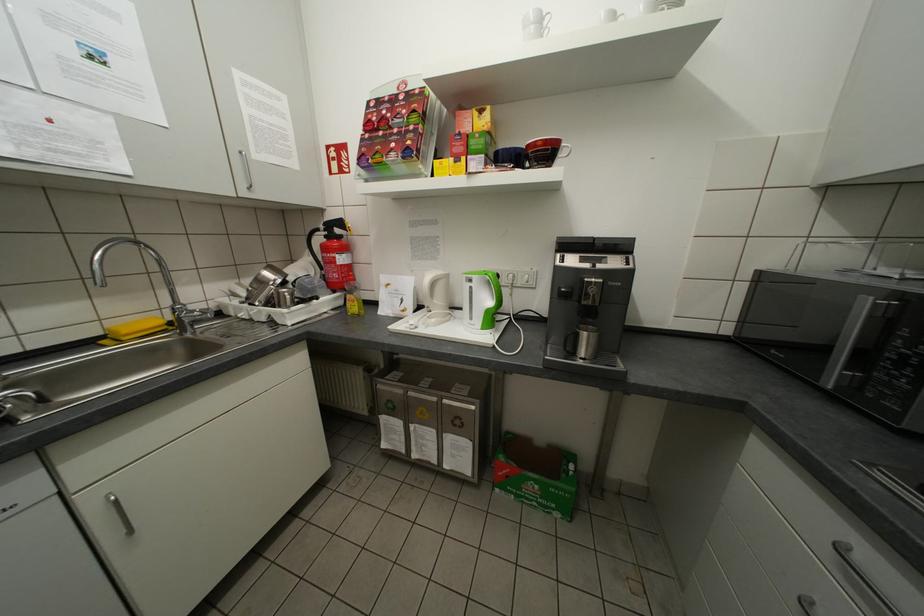
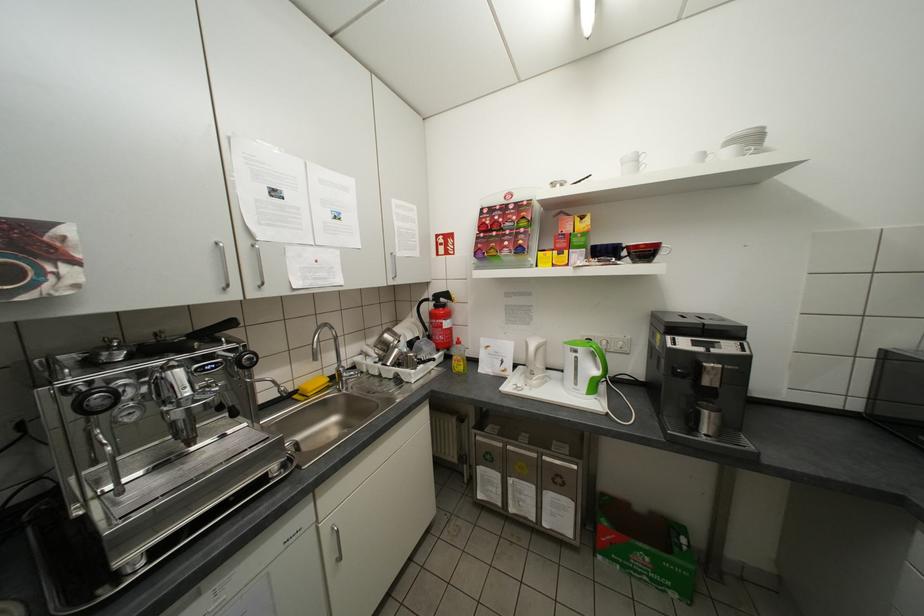
In the second image, find the point that corresponds to pixel 603 238 in the first image.

(712, 323)